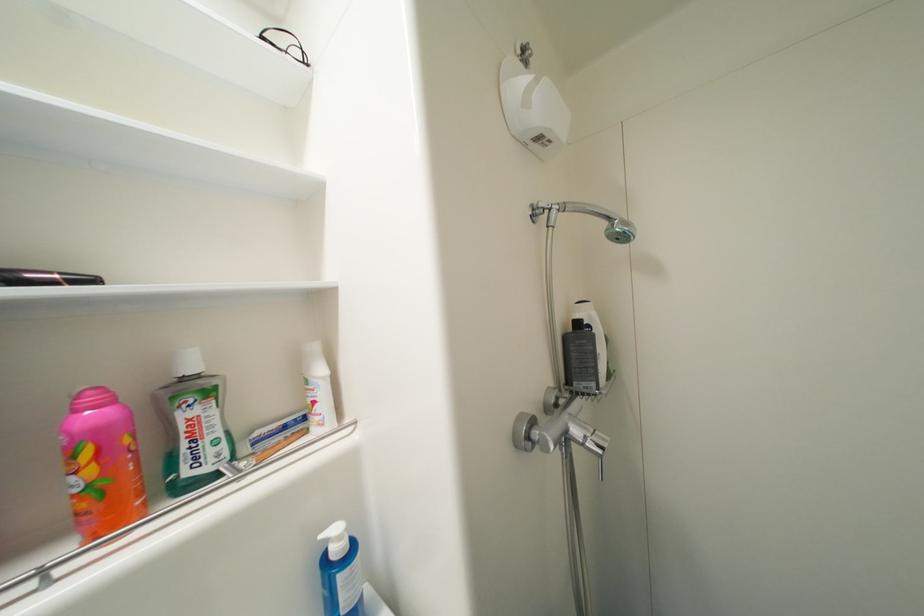
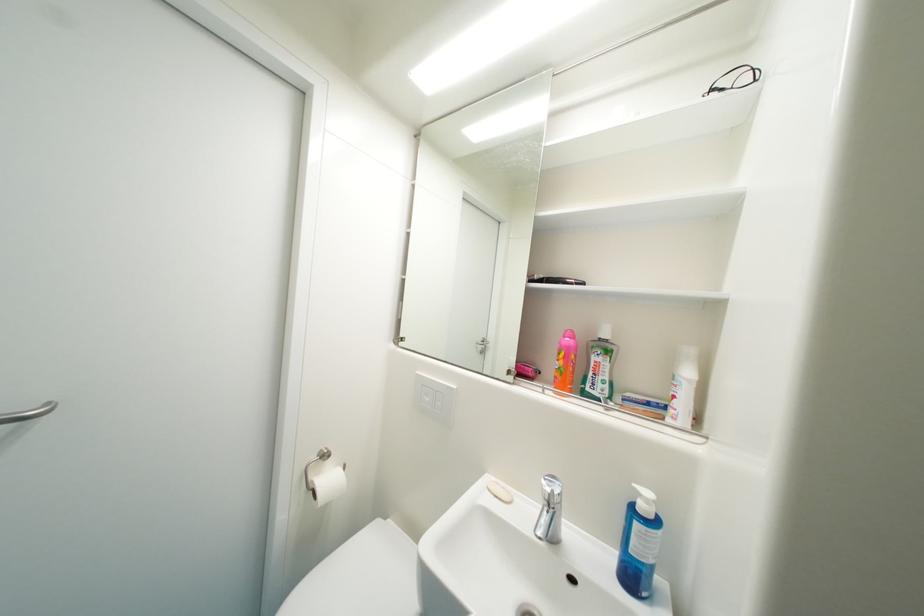
In the second image, find the point that corresponds to [346,540] in the first image.

(653, 503)